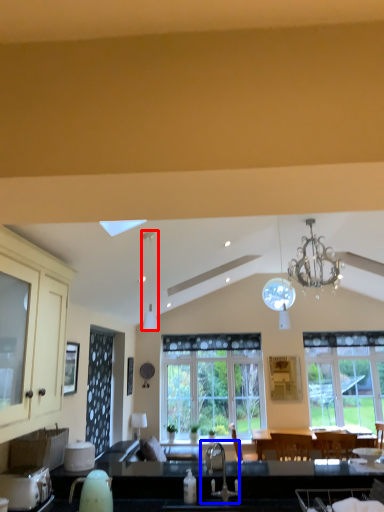
Question: Which of the following is the farthest to the observer, light fixture (highlighted by a red box) or sink (highlighted by a blue box)?

Choices:
 (A) light fixture
 (B) sink

Answer: (A)